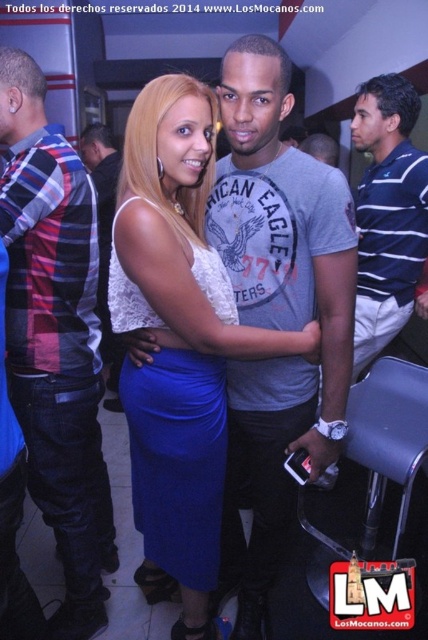
Question: Is plaid fabric shirt at left to the left of blue striped polo shirt at right from the viewer's perspective?

Choices:
 (A) yes
 (B) no

Answer: (A)

Question: Which object appears farthest from the camera in this image?

Choices:
 (A) matte plaid shirt at left
 (B) blue striped polo shirt at right
 (C) lace fabric dress at center

Answer: (A)

Question: Estimate the real-world distances between objects in this image. Which object is closer to the lace fabric dress at center?

Choices:
 (A) blue striped polo shirt at right
 (B) plaid fabric shirt at left
 (C) matte plaid shirt at left

Answer: (B)

Question: Which is nearer to the matte plaid shirt at left?

Choices:
 (A) plaid fabric shirt at left
 (B) blue striped polo shirt at right
 (C) lace fabric dress at center

Answer: (A)

Question: Does lace fabric dress at center have a greater width compared to blue striped polo shirt at right?

Choices:
 (A) yes
 (B) no

Answer: (A)

Question: Is the position of plaid fabric shirt at left less distant than that of matte plaid shirt at left?

Choices:
 (A) yes
 (B) no

Answer: (A)